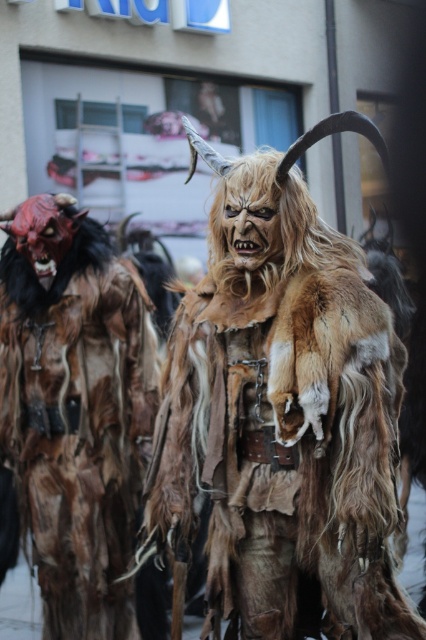
You are a photographer standing at the back of the scene. You want to take a photo of the furry brown costume at center and the brown furry costume at left. Can you fit both of them in your camera frame if your camera has a 5 feet wide field of view?

The furry brown costume at center is 4.26 feet away from the brown furry costume at left. Since the distance between them is less than the camera field of view of 5 feet, both can be captured in the frame.

You are a photographer trying to capture both the furry brown costume at center and the brown furry costume at left in a single frame. Which costume should you focus on first to ensure the taller one is properly framed?

The brown furry costume at left is taller than the furry brown costume at center, so you should focus on the brown furry costume at left first to ensure it is properly framed.